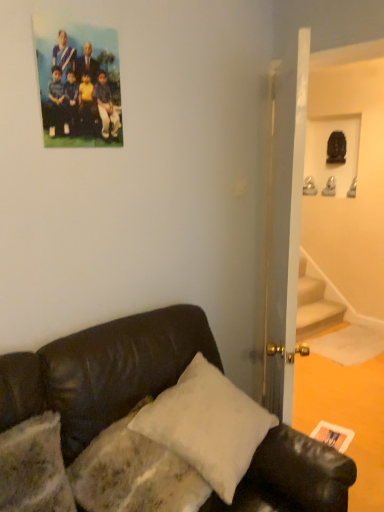
Measure the distance between point (268, 458) and camera.

Point (268, 458) and camera are 1.42 meters apart.

Locate an element on the screen. white soft pillow at lower center is located at coordinates (134, 474).

Where is `matte plastic photo at upper left`? The width and height of the screenshot is (384, 512). matte plastic photo at upper left is located at coordinates (80, 87).

Would you say black leather couch at lower left is part of white matte postcard at lower right's contents?

Actually, black leather couch at lower left is outside white matte postcard at lower right.

Find the location of a particular element. The height and width of the screenshot is (512, 384). studio couch that appears above the white matte postcard at lower right (from the image's perspective) is located at coordinates (103, 371).

Is white matte postcard at lower right not near black leather couch at lower left?

That's right, there is a large distance between white matte postcard at lower right and black leather couch at lower left.

From the image's perspective, which is below, black leather couch at lower left or white matte postcard at lower right?

white matte postcard at lower right is shown below in the image.

Does black leather couch at lower left have a greater width compared to white matte postcard at lower right?

Yes.

Find the location of a particular element. postcard located below the black leather couch at lower left (from the image's perspective) is located at coordinates (333, 435).

Which of these two, black leather couch at lower left or white matte postcard at lower right, is bigger?

black leather couch at lower left is bigger.

Which object is further away from the camera, matte plastic photo at upper left or white matte postcard at lower right?

white matte postcard at lower right.

Consider the image. From a real-world perspective, is matte plastic photo at upper left physically above white matte postcard at lower right?

Yes, from a real-world perspective, matte plastic photo at upper left is above white matte postcard at lower right.

What's the angular difference between matte plastic photo at upper left and white matte postcard at lower right's facing directions?

They differ by 76.5 degrees in their facing directions.

From their relative heights in the image, would you say matte plastic photo at upper left is taller or shorter than white matte postcard at lower right?

Clearly, matte plastic photo at upper left is taller compared to white matte postcard at lower right.

Considering the sizes of matte plastic photo at upper left and black leather couch at lower left in the image, is matte plastic photo at upper left bigger or smaller than black leather couch at lower left?

In the image, matte plastic photo at upper left appears to be smaller than black leather couch at lower left.

Is black leather couch at lower left inside matte plastic photo at upper left?

Definitely not — black leather couch at lower left is not inside matte plastic photo at upper left.

Does matte plastic photo at upper left have a greater width compared to black leather couch at lower left?

In fact, matte plastic photo at upper left might be narrower than black leather couch at lower left.

Image resolution: width=384 pixels, height=512 pixels. I want to click on studio couch lying on the right of matte plastic photo at upper left, so click(x=103, y=371).

Are white soft pillow at lower center and matte plastic photo at upper left far apart?

Yes, white soft pillow at lower center and matte plastic photo at upper left are quite far apart.

Consider the image. Considering the positions of objects white soft pillow at lower center and matte plastic photo at upper left in the image provided, who is behind, white soft pillow at lower center or matte plastic photo at upper left?

matte plastic photo at upper left is further from the camera.

How much distance is there between white soft pillow at lower center and matte plastic photo at upper left?

The distance of white soft pillow at lower center from matte plastic photo at upper left is 3.72 feet.

Is white soft pillow at lower center smaller than matte plastic photo at upper left?

Actually, white soft pillow at lower center might be larger than matte plastic photo at upper left.

Which of these two, black leather couch at lower left or white soft pillow at lower center, is smaller?

white soft pillow at lower center.

Does black leather couch at lower left appear on the right side of white soft pillow at lower center?

Yes.

Is point (168, 322) positioned behind point (187, 489)?

Yes.

From the image's perspective, who appears lower, black leather couch at lower left or white soft pillow at lower center?

black leather couch at lower left.

From the image's perspective, which object appears higher, white matte postcard at lower right or matte plastic photo at upper left?

From the image's view, matte plastic photo at upper left is above.

Can you confirm if white matte postcard at lower right is taller than matte plastic photo at upper left?

No.

Considering the sizes of objects white matte postcard at lower right and matte plastic photo at upper left in the image provided, who is wider, white matte postcard at lower right or matte plastic photo at upper left?

With larger width is white matte postcard at lower right.

Where is `postcard behind the black leather couch at lower left`? Image resolution: width=384 pixels, height=512 pixels. postcard behind the black leather couch at lower left is located at coordinates (333, 435).

Where is `postcard below the black leather couch at lower left (from a real-world perspective)`? This screenshot has width=384, height=512. postcard below the black leather couch at lower left (from a real-world perspective) is located at coordinates (333, 435).

Estimate the real-world distances between objects in this image. Which object is closer to white soft pillow at lower center, white matte postcard at lower right or black leather couch at lower left?

Based on the image, black leather couch at lower left appears to be nearer to white soft pillow at lower center.

From the image, which object appears to be nearer to white soft pillow at lower center, black leather couch at lower left or matte plastic photo at upper left?

Based on the image, black leather couch at lower left appears to be nearer to white soft pillow at lower center.

From the image, which object appears to be nearer to matte plastic photo at upper left, white soft pillow at lower center or white matte postcard at lower right?

Among the two, white soft pillow at lower center is located nearer to matte plastic photo at upper left.

Based on their spatial positions, is white soft pillow at lower center or matte plastic photo at upper left closer to black leather couch at lower left?

white soft pillow at lower center lies closer to black leather couch at lower left than the other object.

Estimate the real-world distances between objects in this image. Which object is closer to black leather couch at lower left, white matte postcard at lower right or matte plastic photo at upper left?

Based on the image, matte plastic photo at upper left appears to be nearer to black leather couch at lower left.

Estimate the real-world distances between objects in this image. Which object is closer to black leather couch at lower left, white matte postcard at lower right or white soft pillow at lower center?

white soft pillow at lower center is closer to black leather couch at lower left.

When comparing their distances from white soft pillow at lower center, does white matte postcard at lower right or matte plastic photo at upper left seem further?

white matte postcard at lower right lies further to white soft pillow at lower center than the other object.

Based on their spatial positions, is white matte postcard at lower right or white soft pillow at lower center closer to matte plastic photo at upper left?

white soft pillow at lower center is positioned closer to the anchor matte plastic photo at upper left.

You are a GUI agent. You are given a task and a screenshot of the screen. Output one action in this format:
    pyautogui.click(x=<x>, y=<y>)
    Task: Click on the studio couch between matte plastic photo at upper left and white matte postcard at lower right in the up-down direction
    Image resolution: width=384 pixels, height=512 pixels.
    Given the screenshot: What is the action you would take?
    pyautogui.click(x=103, y=371)

You are a GUI agent. You are given a task and a screenshot of the screen. Output one action in this format:
    pyautogui.click(x=<x>, y=<y>)
    Task: Click on the pillow that lies between matte plastic photo at upper left and white matte postcard at lower right from top to bottom
    
    Given the screenshot: What is the action you would take?
    pyautogui.click(x=134, y=474)

In order to click on pillow between black leather couch at lower left and white matte postcard at lower right from front to back in this screenshot , I will do `click(134, 474)`.

Where is `pillow that lies between matte plastic photo at upper left and black leather couch at lower left from top to bottom`? This screenshot has width=384, height=512. pillow that lies between matte plastic photo at upper left and black leather couch at lower left from top to bottom is located at coordinates (134, 474).